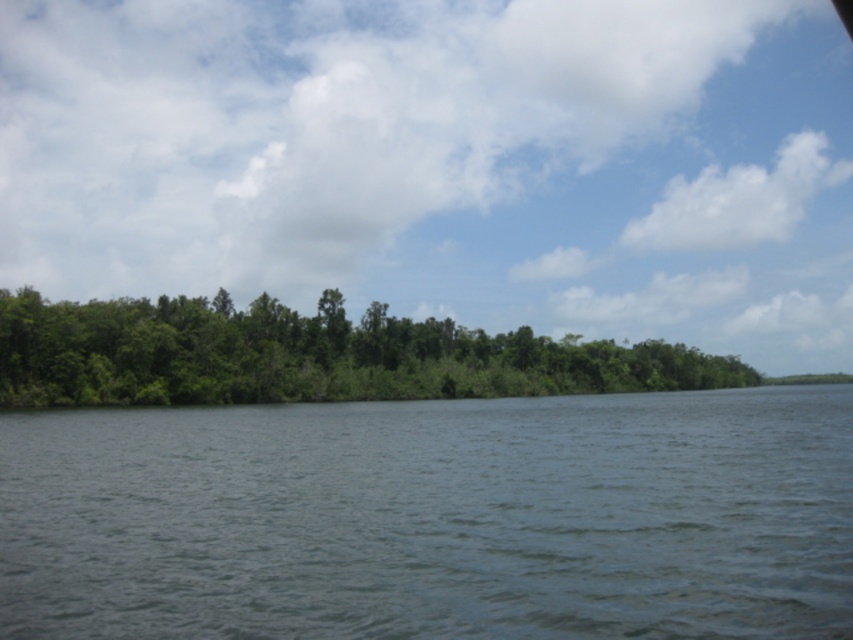
The image size is (853, 640). Describe the element at coordinates (434, 518) in the screenshot. I see `dark blue water at center` at that location.

Does dark blue water at center appear on the right side of green leafy trees at center?

Incorrect, dark blue water at center is not on the right side of green leafy trees at center.

Is point (722, 600) in front of point (482, 346)?

Yes, it is.

At what (x,y) coordinates should I click in order to perform the action: click on dark blue water at center. Please return your answer as a coordinate pair (x, y). The width and height of the screenshot is (853, 640). Looking at the image, I should click on (434, 518).